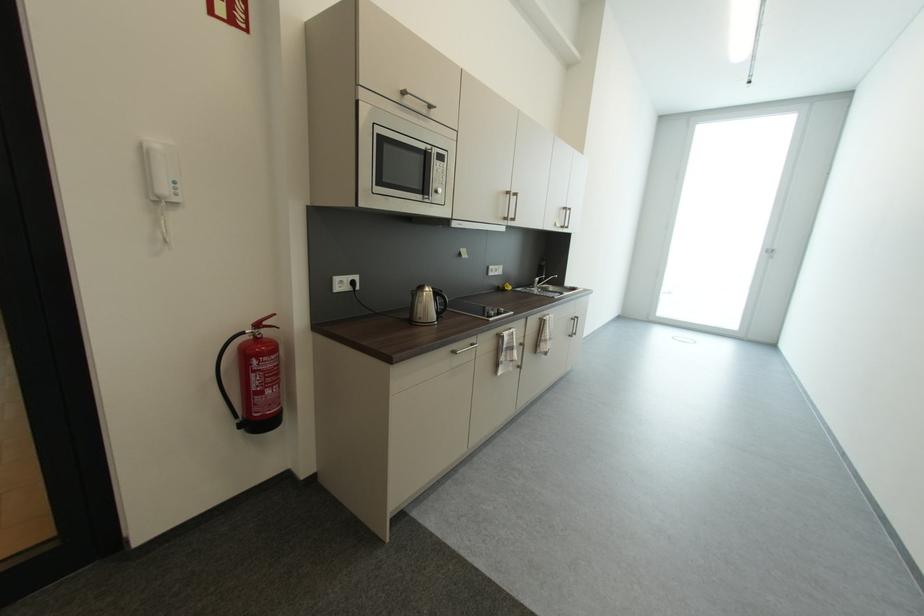
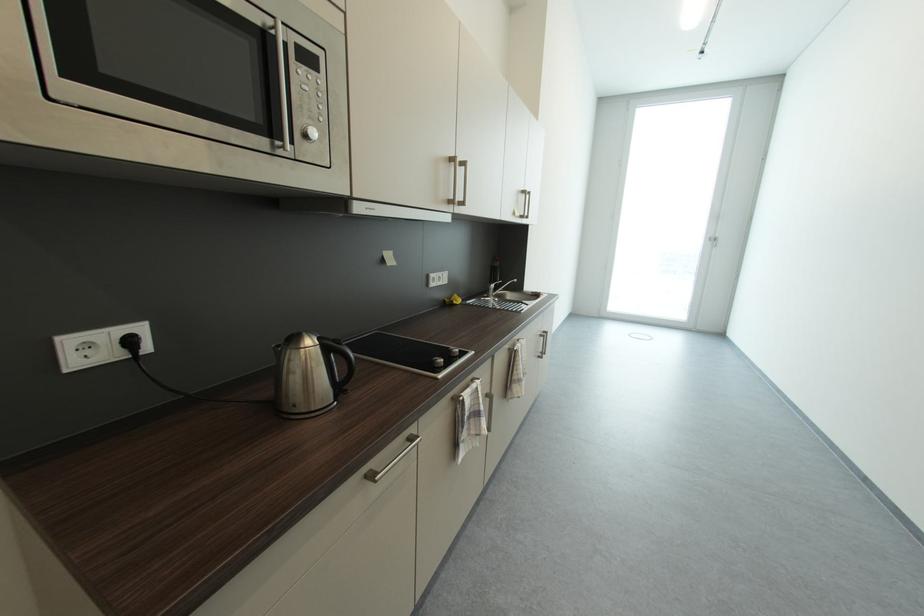
The point at (513,220) is marked in the first image. Where is the corresponding point in the second image?

(457, 204)